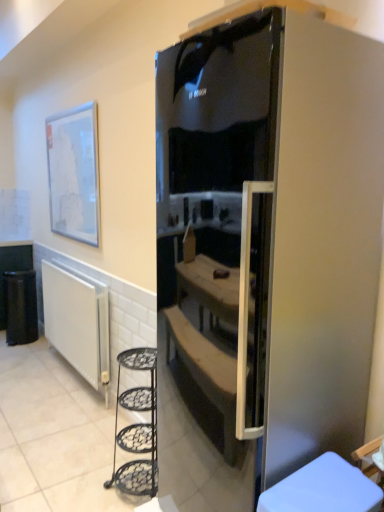
Question: From the image's perspective, is matte white picture frame at upper left positioned above or below white ribbed radiator at lower left?

Choices:
 (A) below
 (B) above

Answer: (B)

Question: Considering the positions of matte white picture frame at upper left and white ribbed radiator at lower left in the image, is matte white picture frame at upper left taller or shorter than white ribbed radiator at lower left?

Choices:
 (A) tall
 (B) short

Answer: (A)

Question: Which object is the farthest from the satin black fridge at center?

Choices:
 (A) white ribbed radiator at lower left
 (B) white plastic stool at lower right
 (C) matte white picture frame at upper left
 (D) black plastic trash bin at lower left

Answer: (D)

Question: Considering the real-world distances, which object is closest to the black plastic trash bin at lower left?

Choices:
 (A) matte white picture frame at upper left
 (B) white ribbed radiator at lower left
 (C) white plastic stool at lower right
 (D) satin black fridge at center

Answer: (B)